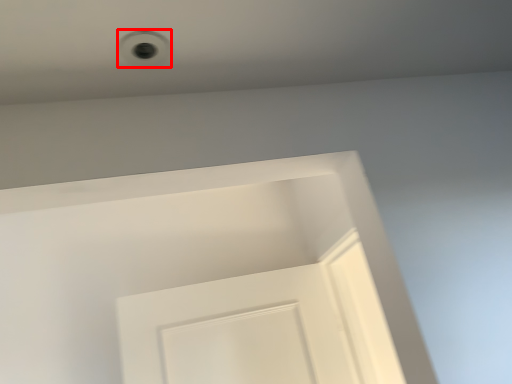
Question: From the image's perspective, what is the correct spatial relationship of hole (annotated by the red box) in relation to screen door?

Choices:
 (A) above
 (B) below

Answer: (A)